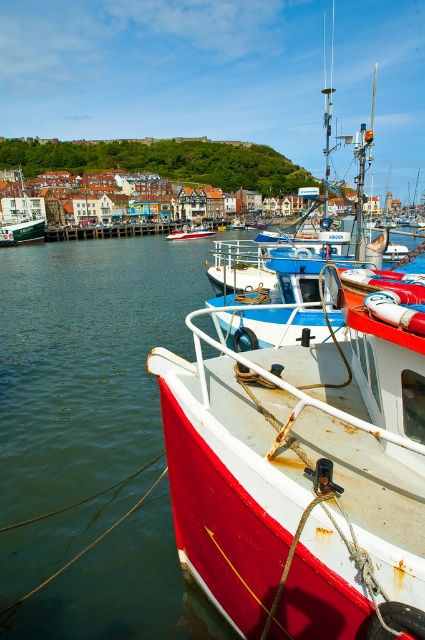
Question: Which is farther from the smooth water at center?

Choices:
 (A) white glossy boat at center
 (B) white matte boat at center
 (C) smooth wooden dock at center

Answer: (C)

Question: In this image, where is smooth water at center located relative to white glossy boat at center?

Choices:
 (A) below
 (B) above

Answer: (A)

Question: Can you confirm if smooth water at center is bigger than white matte boat at center?

Choices:
 (A) yes
 (B) no

Answer: (A)

Question: Among these points, which one is nearest to the camera?

Choices:
 (A) (57, 240)
 (B) (23, 232)

Answer: (B)

Question: Which point appears closest to the camera in this image?

Choices:
 (A) click(x=169, y=236)
 (B) click(x=79, y=234)
 (C) click(x=99, y=416)

Answer: (C)

Question: Does white matte boat at center lie behind smooth wooden dock at center?

Choices:
 (A) no
 (B) yes

Answer: (A)